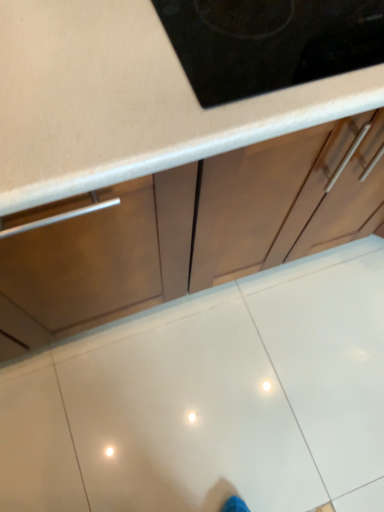
Question: Is white glossy tile at center taller or shorter than matte brown cabinet at center?

Choices:
 (A) short
 (B) tall

Answer: (A)

Question: From the image's perspective, is white glossy tile at center located above or below matte brown cabinet at center?

Choices:
 (A) above
 (B) below

Answer: (B)

Question: In the image, is white glossy tile at center positioned in front of or behind matte brown cabinet at center?

Choices:
 (A) behind
 (B) front

Answer: (A)

Question: Considering their positions, is matte brown cabinet at center located in front of or behind white glossy tile at center?

Choices:
 (A) front
 (B) behind

Answer: (A)

Question: Considering the positions of matte brown cabinet at center and white glossy tile at center in the image, is matte brown cabinet at center wider or thinner than white glossy tile at center?

Choices:
 (A) thin
 (B) wide

Answer: (A)

Question: Which is correct: matte brown cabinet at center is inside white glossy tile at center, or outside of it?

Choices:
 (A) inside
 (B) outside

Answer: (B)

Question: Does point (46, 261) appear closer or farther from the camera than point (248, 329)?

Choices:
 (A) closer
 (B) farther

Answer: (A)